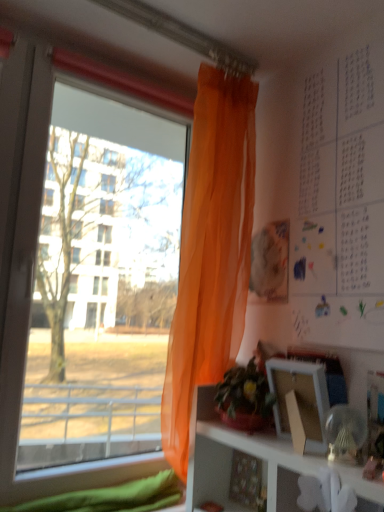
The width and height of the screenshot is (384, 512). I want to click on free point above transparent orange curtain at left (from a real-world perspective), so click(99, 52).